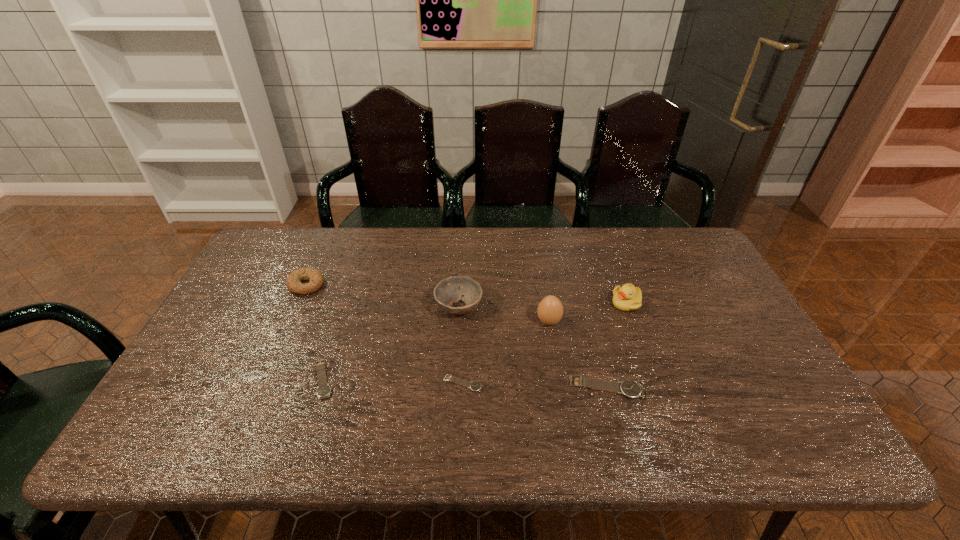
Identify the location of object that is at the left edge. (316, 279).

Where is `free space at the far edge`? free space at the far edge is located at coordinates (584, 248).

Locate an element on the screen. vacant space at the near edge of the desktop is located at coordinates (574, 412).

At what (x,y) coordinates should I click in order to perform the action: click on blank space at the left edge. Please return your answer as a coordinate pair (x, y). The height and width of the screenshot is (540, 960). Looking at the image, I should click on 218,328.

Find the location of `vacant area at the right edge`. vacant area at the right edge is located at coordinates (740, 328).

This screenshot has height=540, width=960. Find the location of `vacant space at the far left corner of the desktop`. vacant space at the far left corner of the desktop is located at coordinates (268, 254).

In order to click on free spot at the near left corner of the desktop in this screenshot , I will do `click(188, 404)`.

Where is `vacant region at the far right corner of the desktop`? This screenshot has width=960, height=540. vacant region at the far right corner of the desktop is located at coordinates (693, 255).

Identify the location of blank region between the bowl and the tallest watch. This screenshot has height=540, width=960. (533, 348).

Where is `free area in between the fifth tallest object and the duckling`? This screenshot has height=540, width=960. free area in between the fifth tallest object and the duckling is located at coordinates (616, 346).